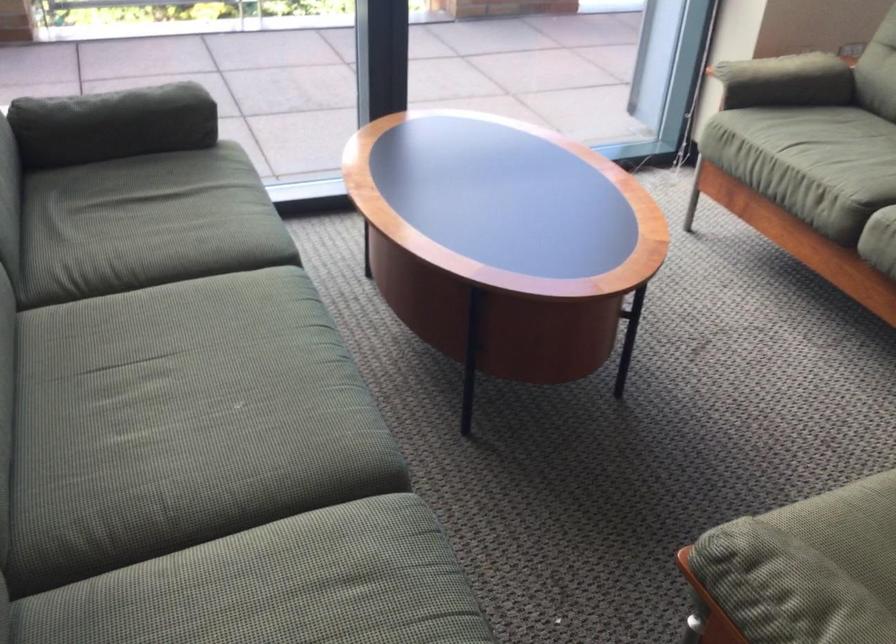
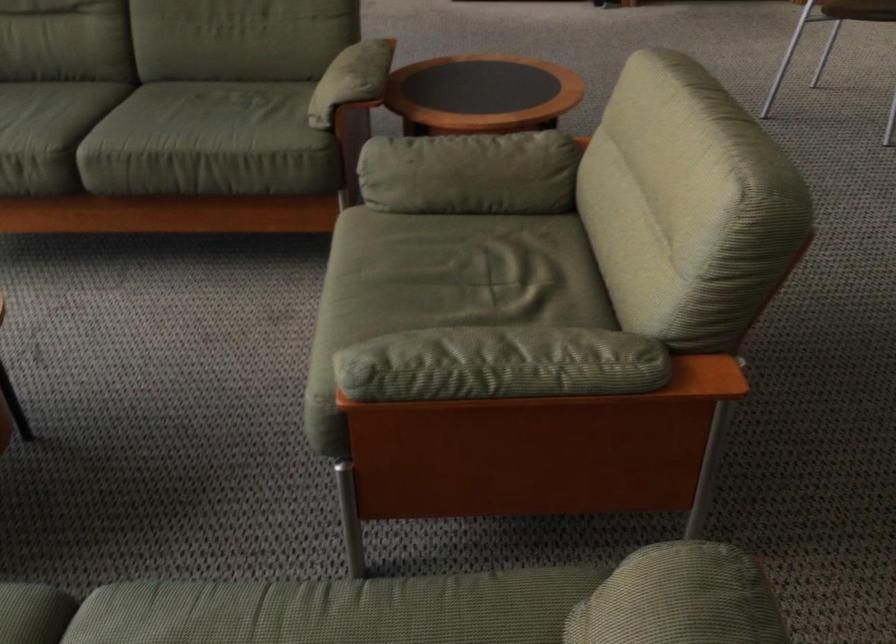
Based on the continuous images, in which direction is the camera rotating?

The camera's rotation is toward right-down.